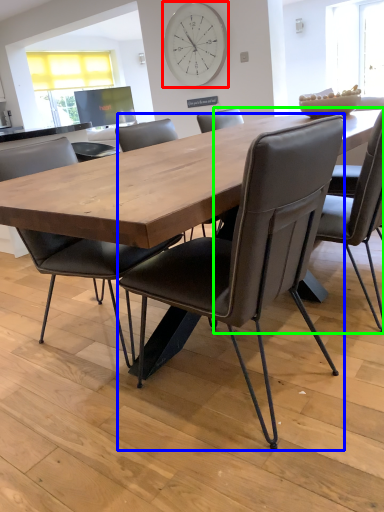
Question: Based on their relative distances, which object is farther from clock (highlighted by a red box)? Choose from chair (highlighted by a blue box) and chair (highlighted by a green box).

Choices:
 (A) chair
 (B) chair

Answer: (A)